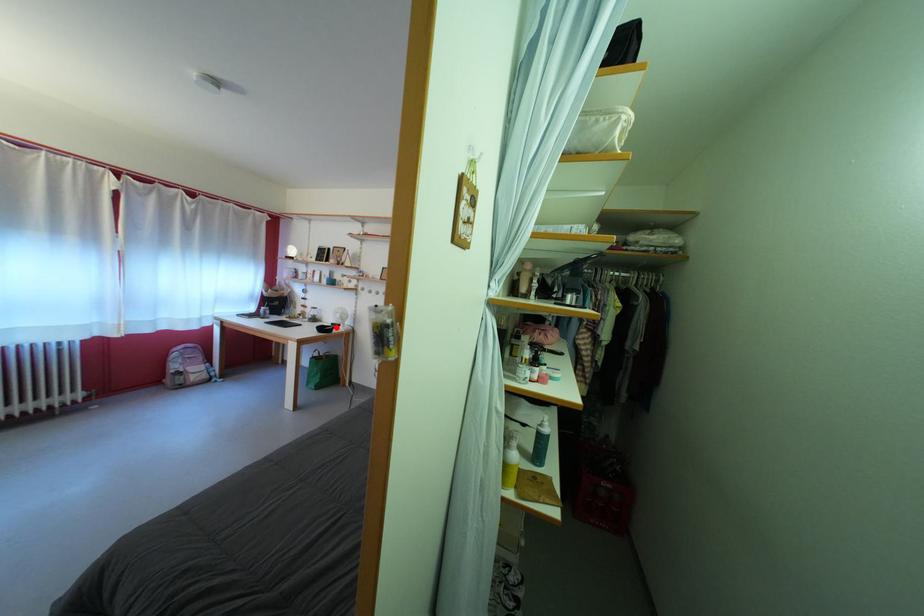
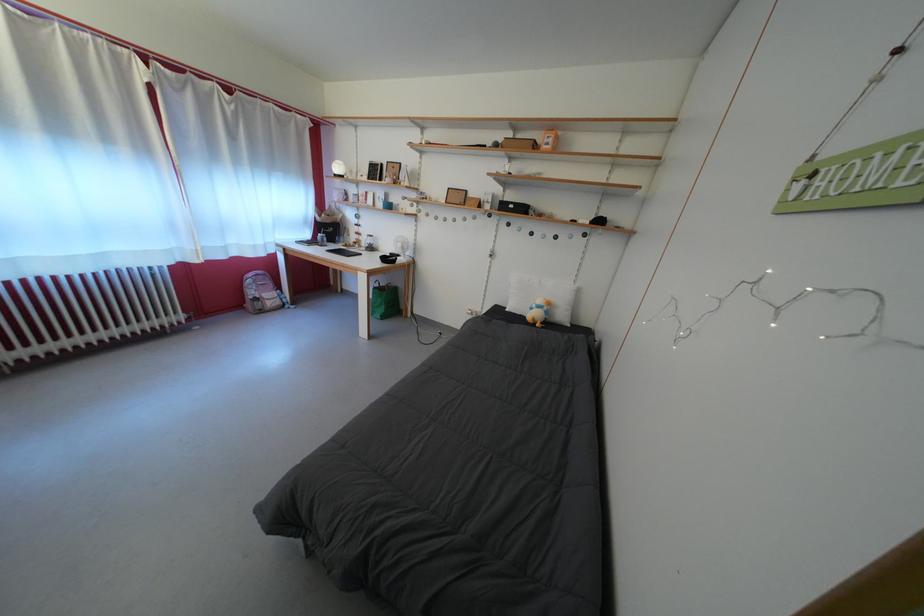
Find the pixel in the second image that matches the highlighted location in the first image.

(394, 257)